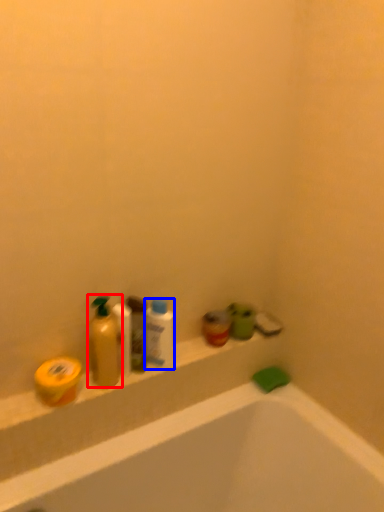
Question: Which object is further to the camera taking this photo, cleaning product (highlighted by a red box) or mouthwash (highlighted by a blue box)?

Choices:
 (A) cleaning product
 (B) mouthwash

Answer: (B)